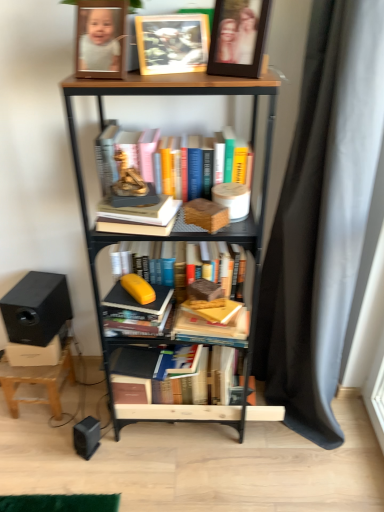
Question: Is wooden statue at center bigger or smaller than hardcover book at center, the 4th book from the top?

Choices:
 (A) big
 (B) small

Answer: (B)

Question: Do you think wooden statue at center is within hardcover book at center, the 4th book from the top, or outside of it?

Choices:
 (A) outside
 (B) inside

Answer: (A)

Question: Which of these objects is positioned farthest from the wooden paperback book at center?

Choices:
 (A) wooden statue at center
 (B) hardcover book at center, placed as the 3th book when sorted from top to bottom
 (C) wooden bookcase at center
 (D) hardcover book at center, the 4th book from the top
 (E) black plastic speaker at lower left, marked as the first speaker in a bottom-to-top arrangement

Answer: (E)

Question: Estimate the real-world distances between objects in this image. Which object is closer to the wooden picture frame at upper center, arranged as the 2th picture frame when viewed from the left?

Choices:
 (A) hardcover book at center, the 4th book from the top
 (B) wooden stool at lower left
 (C) wooden paperback book at center
 (D) wooden photo frame at upper center, positioned as the 1th picture frame in left-to-right order
 (E) wooden statue at center

Answer: (D)